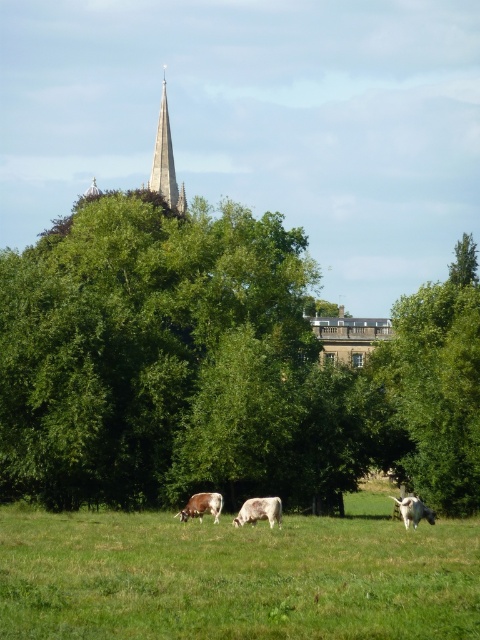
You are standing at the point marked by the coordinates point (237,577) in the image. What is the nearest object to you in the scene?

The nearest object to you at point (237,577) is the green grass at center, as you are standing on it.

You are standing in the rural landscape scene and want to reach a specific point marked at coordinates point (159, 168). If your walking speed is 3 feet per second, how many seconds will it take you to reach that point?

The distance of point (159, 168) from viewer is 722.23 feet. At a walking speed of 3 feet per second, it will take 722.23 divided by 3, which is approximately 240.74 seconds to reach the point.